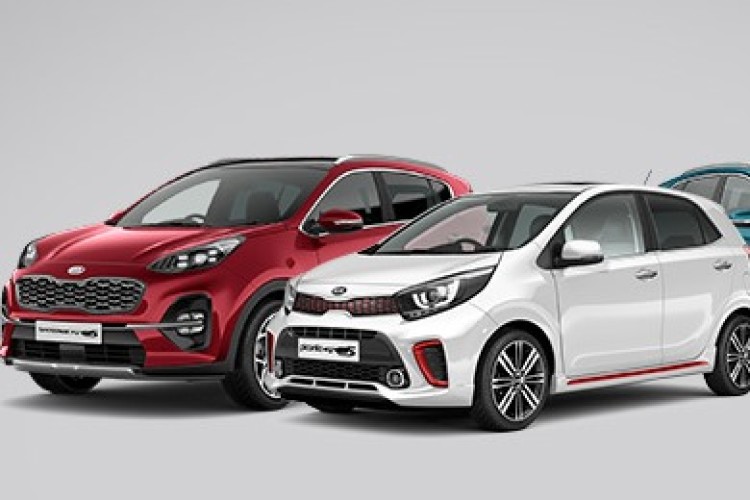
At what (x,y) coordinates should I click in order to perform the action: click on window. Please return your answer as a coordinate pair (x, y). Looking at the image, I should click on (736, 199), (700, 183), (621, 226), (679, 216), (513, 223), (394, 196), (441, 193), (244, 193).